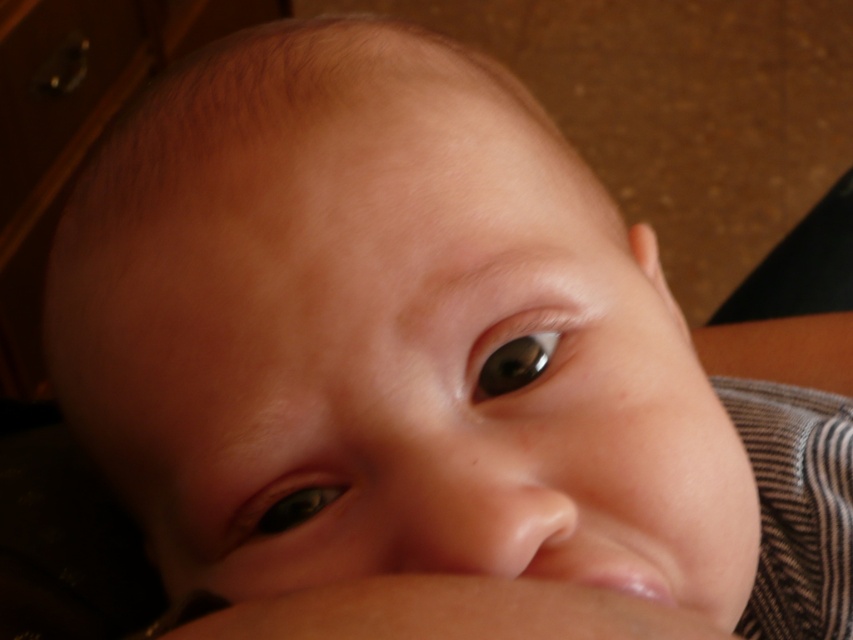
Question: Does green glossy eye at lower left appear over brown glossy eye at upper center?

Choices:
 (A) yes
 (B) no

Answer: (B)

Question: Does green glossy eye at lower left have a lesser width compared to brown glossy eye at upper center?

Choices:
 (A) no
 (B) yes

Answer: (A)

Question: Among these objects, which one is farthest from the camera?

Choices:
 (A) brown glossy eye at upper center
 (B) green glossy eye at lower left

Answer: (B)

Question: Which of the following is the closest to the observer?

Choices:
 (A) (306, 490)
 (B) (521, 314)

Answer: (B)

Question: Can you confirm if green glossy eye at lower left is bigger than brown glossy eye at upper center?

Choices:
 (A) no
 (B) yes

Answer: (B)